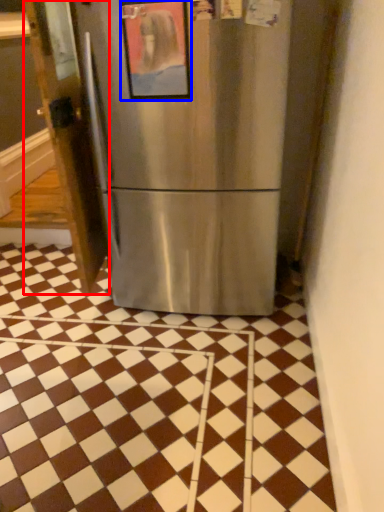
Question: Which of the following is the farthest to the observer, door (highlighted by a red box) or picture frame (highlighted by a blue box)?

Choices:
 (A) door
 (B) picture frame

Answer: (A)